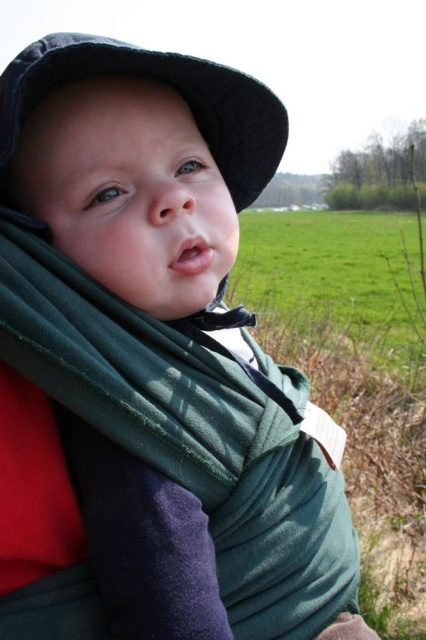
Question: Can you confirm if green grass field at center is positioned above black fabric hat at upper left?

Choices:
 (A) no
 (B) yes

Answer: (A)

Question: Which point appears closest to the camera in this image?

Choices:
 (A) (419, 362)
 (B) (210, 77)

Answer: (B)

Question: Is green grass field at center further to the viewer compared to black fabric hat at upper left?

Choices:
 (A) yes
 (B) no

Answer: (A)

Question: Which point is closer to the camera taking this photo?

Choices:
 (A) (115, 61)
 (B) (382, 324)

Answer: (A)

Question: Considering the relative positions of green grass field at center and black fabric hat at upper left in the image provided, where is green grass field at center located with respect to black fabric hat at upper left?

Choices:
 (A) left
 (B) right

Answer: (B)

Question: Which of the following is the closest to the observer?

Choices:
 (A) black fabric hat at upper left
 (B) green grass field at center

Answer: (A)